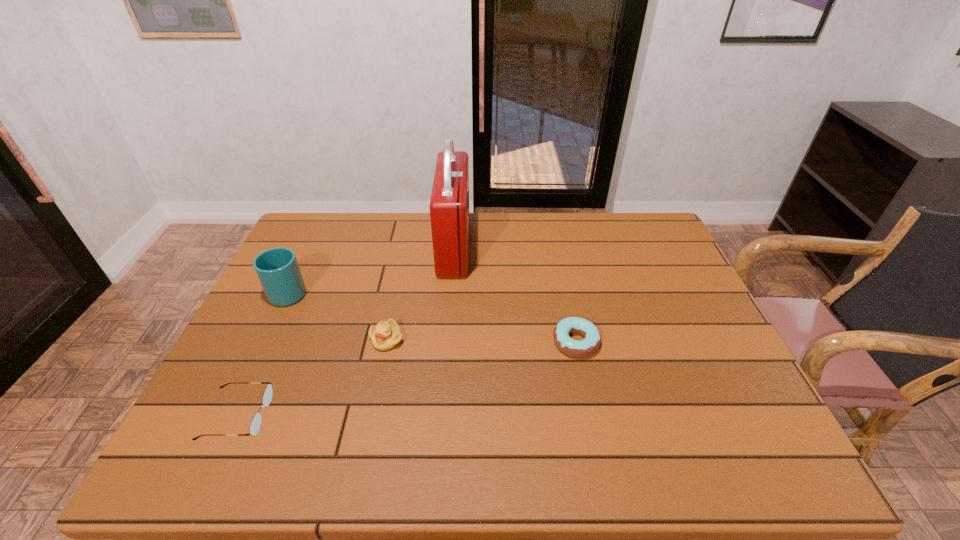
Identify the location of vacant region at the near edge of the desktop. (405, 433).

Image resolution: width=960 pixels, height=540 pixels. In the image, there is a desktop. Find the location of `vacant region at the left edge`. vacant region at the left edge is located at coordinates (286, 377).

In order to click on free space at the far left corner of the desktop in this screenshot , I will do `click(342, 239)`.

This screenshot has height=540, width=960. What are the coordinates of `vacant space in between the first-aid kit and the doughnut` in the screenshot? It's located at coord(515,294).

Locate an element on the screen. empty space that is in between the second tallest object and the tallest object is located at coordinates (372, 269).

The width and height of the screenshot is (960, 540). Find the location of `free space between the duckling and the second object from right to left`. free space between the duckling and the second object from right to left is located at coordinates (420, 293).

Where is `free space between the duckling and the doughnut`? The width and height of the screenshot is (960, 540). free space between the duckling and the doughnut is located at coordinates (481, 340).

At what (x,y) coordinates should I click in order to perform the action: click on vacant area that lies between the second tallest object and the third tallest object. Please return your answer as a coordinate pair (x, y). This screenshot has width=960, height=540. Looking at the image, I should click on (338, 315).

You are a GUI agent. You are given a task and a screenshot of the screen. Output one action in this format:
    pyautogui.click(x=<x>, y=<y>)
    Task: Click on the free space between the fourth shortest object and the tallest object
    
    Given the screenshot: What is the action you would take?
    pyautogui.click(x=372, y=269)

Locate an element on the screen. This screenshot has width=960, height=540. free space between the duckling and the second tallest object is located at coordinates (338, 315).